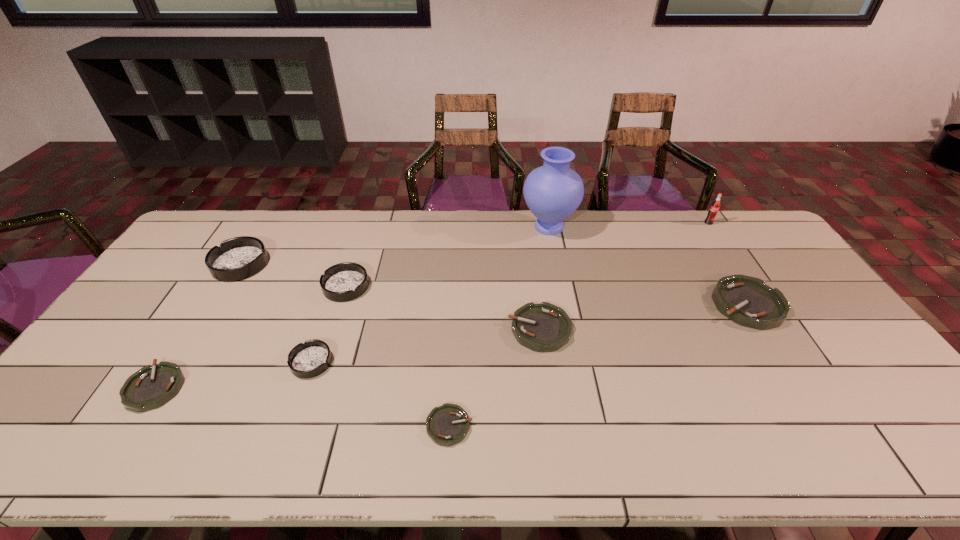
In the image, there is a desktop. At what (x,y) coordinates should I click in order to perform the action: click on vacant space at the far edge. Please return your answer as a coordinate pair (x, y). This screenshot has width=960, height=540. Looking at the image, I should click on pos(697,249).

Identify the location of vacant space at the near edge of the desktop. This screenshot has width=960, height=540. (213, 463).

In the image, there is a desktop. Where is `free space at the right edge`? This screenshot has height=540, width=960. free space at the right edge is located at coordinates (792, 310).

At what (x,y) coordinates should I click in order to perform the action: click on free region at the far left corner. Please return your answer as a coordinate pair (x, y). Looking at the image, I should click on (229, 213).

Locate an element on the screen. The height and width of the screenshot is (540, 960). empty space between the vase and the third biggest green ashtray is located at coordinates (352, 307).

Locate an element on the screen. free spot between the third biggest green ashtray and the vase is located at coordinates (352, 307).

Locate an element on the screen. vacant space that is in between the second smallest dark ashtray and the fifth object from left to right is located at coordinates coord(397,356).

The image size is (960, 540). Find the location of `free spot between the second ashtray from right to left and the fifth object from left to right`. free spot between the second ashtray from right to left and the fifth object from left to right is located at coordinates (494, 377).

You are a GUI agent. You are given a task and a screenshot of the screen. Output one action in this format:
    pyautogui.click(x=<x>, y=<y>)
    Task: Click on the free space between the second green ashtray from left to right and the third green ashtray from left to right
    
    Given the screenshot: What is the action you would take?
    pyautogui.click(x=494, y=377)

Identify the location of free space between the second biggest dark ashtray and the tallest object. The width and height of the screenshot is (960, 540). pos(447,257).